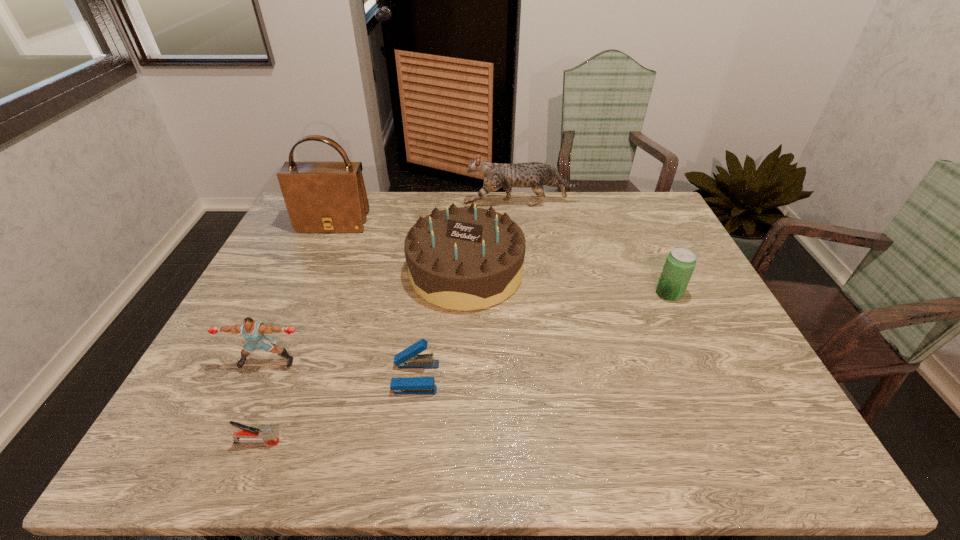
Where is `vacant space at the right edge of the desktop`? vacant space at the right edge of the desktop is located at coordinates (724, 328).

Identify the location of vacant space at the far left corner of the desktop. The height and width of the screenshot is (540, 960). (291, 226).

You are a GUI agent. You are given a task and a screenshot of the screen. Output one action in this format:
    pyautogui.click(x=<x>, y=<y>)
    Task: Click on the vacant region between the farther stapler and the birthday cake
    
    Given the screenshot: What is the action you would take?
    pyautogui.click(x=441, y=325)

Where is `vacant space in between the birthday cake and the puncher`? This screenshot has width=960, height=540. vacant space in between the birthday cake and the puncher is located at coordinates (367, 317).

Identify the location of empty space that is in between the nearest object and the farther stapler. This screenshot has width=960, height=540. (336, 410).

At what (x,y) coordinates should I click in order to perform the action: click on unoccupied position between the farther stapler and the soda. Please return your answer as a coordinate pair (x, y). The image size is (960, 540). Looking at the image, I should click on (542, 335).

The height and width of the screenshot is (540, 960). I want to click on empty location between the puncher and the soda, so click(468, 328).

Where is `empty space that is in between the nearer stapler and the shoulder bag`? The height and width of the screenshot is (540, 960). empty space that is in between the nearer stapler and the shoulder bag is located at coordinates (295, 333).

This screenshot has width=960, height=540. In order to click on object that stands as the third closest to the puncher in this screenshot , I will do `click(463, 258)`.

Identify which object is the second nearest to the sixth nearest object. Please provide its 2D coordinates. Your answer should be formatted as a tuple, i.e. [(x, y)], where the tuple contains the x and y coordinates of a point satisfying the conditions above.

[(534, 175)]